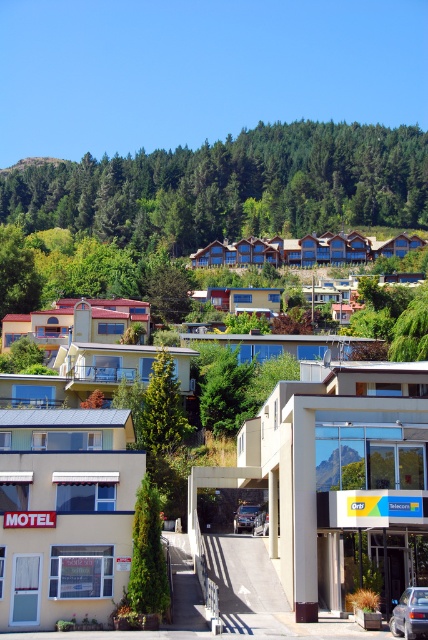
Looking at this image, you are a delivery person trying to determine the best route to the beige matte motel at lower left. You see the beige concrete building at center nearby. Which building should you head towards first, and why?

You should head towards the beige concrete building at center first because it is larger in size than the beige matte motel at lower left, making it easier to locate from a distance.

You are standing at the entrance of the beige matte motel at lower left and want to see the metallic silver car at center. In which direction should you look relative to your position?

The beige matte motel at lower left is located above the metallic silver car at center, so you should look downward to see the metallic silver car at center.